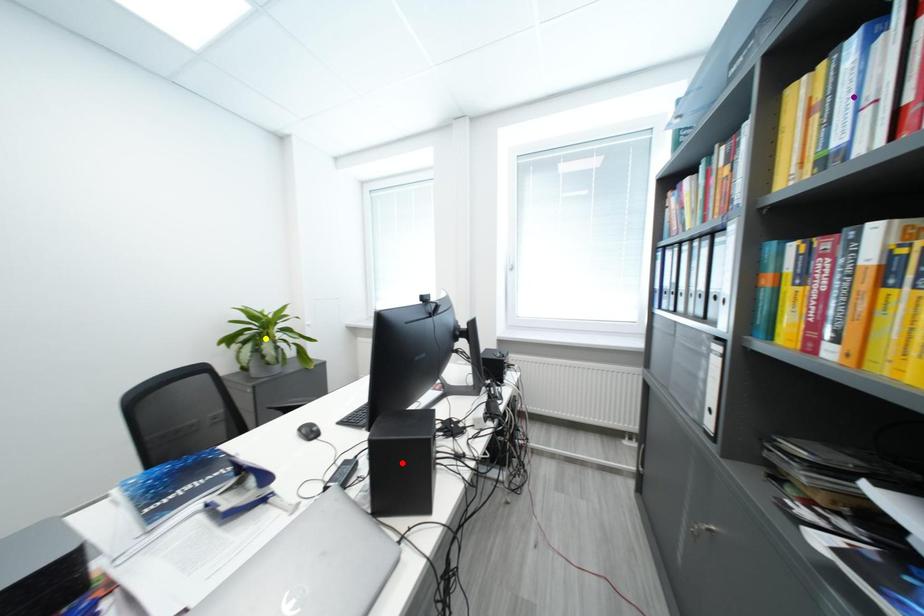
Order these from nearest to farthest:
1. yellow point
2. red point
3. purple point

1. purple point
2. red point
3. yellow point